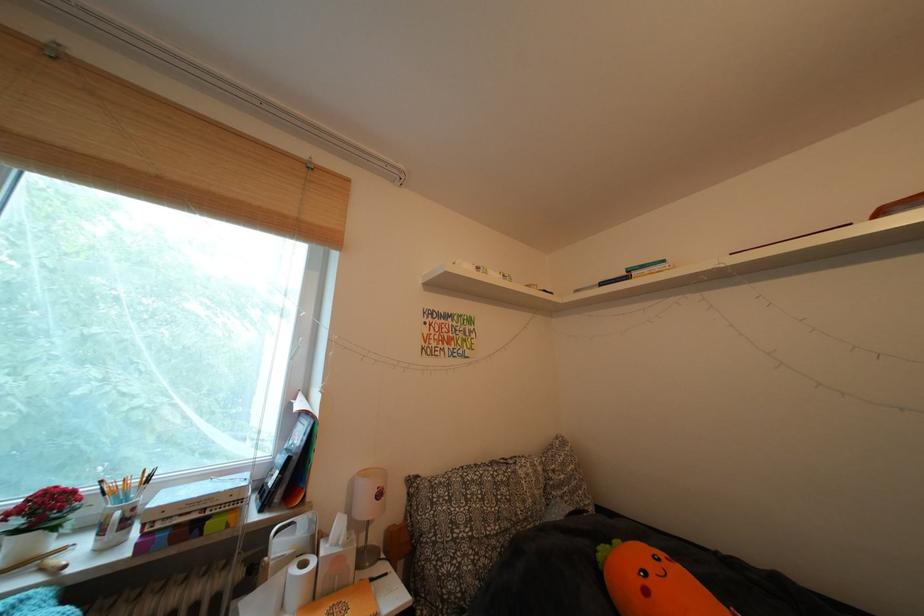
At what (x,y) coordinates should I click in order to perform the action: click on white flower pot. Please return your answer as a coordinate pair (x, y). This screenshot has height=616, width=924. Looking at the image, I should click on (35, 523).